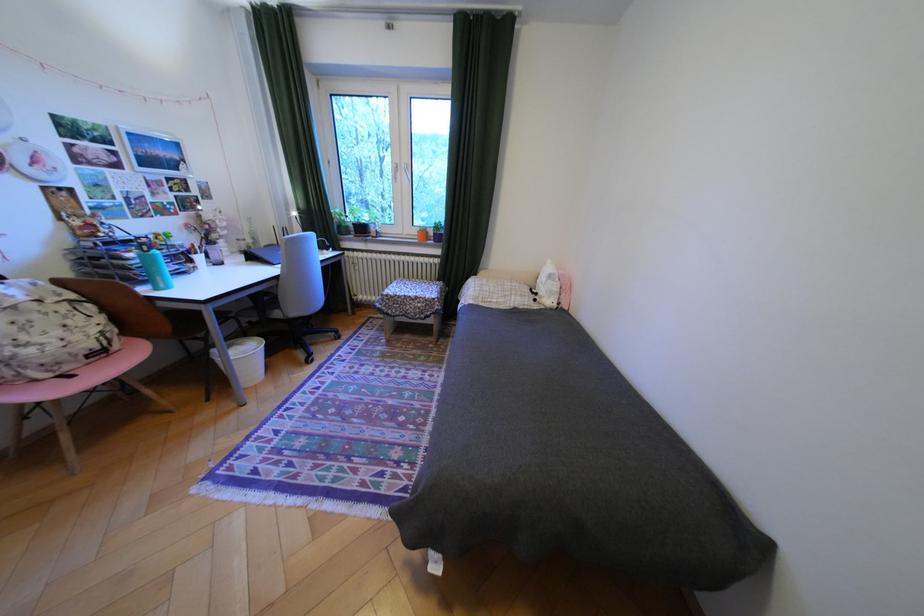
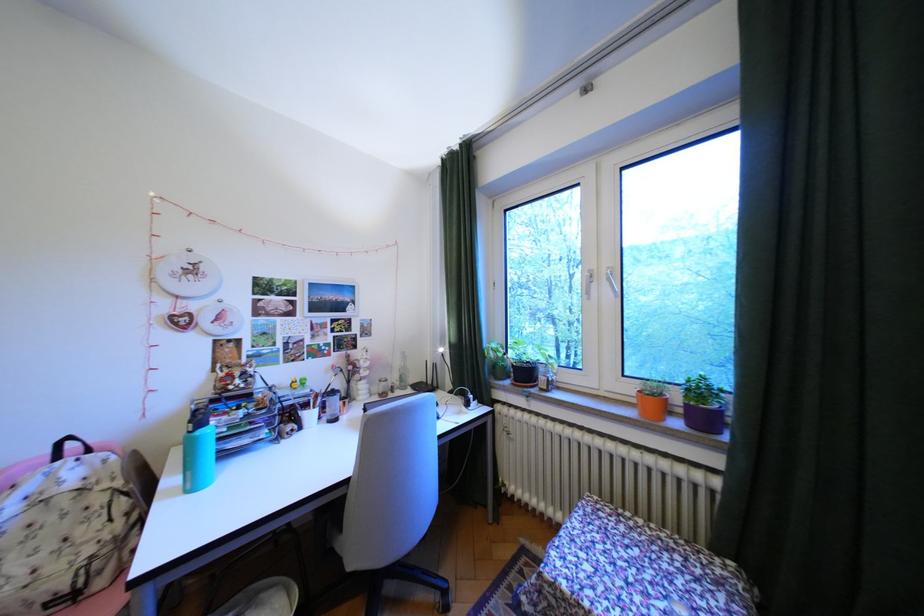
The point at [288,278] is marked in the first image. Where is the corresponding point in the second image?

(359, 483)